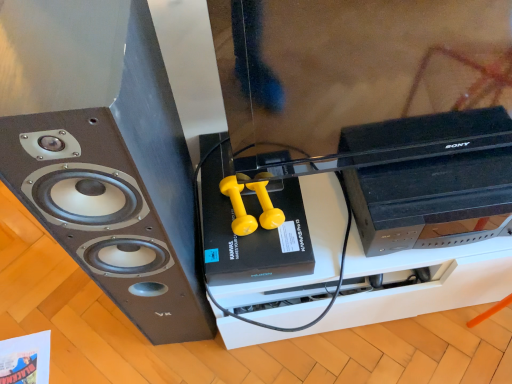
Question: Considering the positions of black matte speaker at left and black plastic computer at right in the image, is black matte speaker at left wider or thinner than black plastic computer at right?

Choices:
 (A) wide
 (B) thin

Answer: (A)

Question: Do you think black matte speaker at left is within black plastic computer at right, or outside of it?

Choices:
 (A) outside
 (B) inside

Answer: (A)

Question: From the image's perspective, is black matte speaker at left above or below black plastic computer at right?

Choices:
 (A) below
 (B) above

Answer: (A)

Question: Considering the positions of black plastic computer at right and black matte speaker at left in the image, is black plastic computer at right wider or thinner than black matte speaker at left?

Choices:
 (A) thin
 (B) wide

Answer: (A)

Question: In the image, is black plastic computer at right on the left side or the right side of black matte speaker at left?

Choices:
 (A) right
 (B) left

Answer: (A)

Question: Relative to black matte speaker at left, is black plastic computer at right in front or behind?

Choices:
 (A) front
 (B) behind

Answer: (B)

Question: Is black plastic computer at right inside the boundaries of black matte speaker at left, or outside?

Choices:
 (A) outside
 (B) inside

Answer: (A)